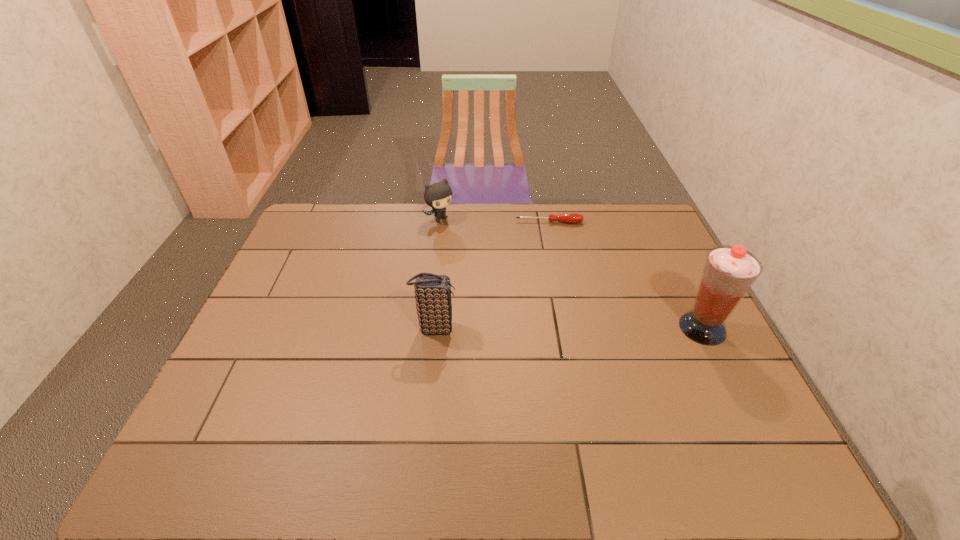
Where is `vacant area that lies between the second object from right to left and the smoothie`? The height and width of the screenshot is (540, 960). vacant area that lies between the second object from right to left and the smoothie is located at coordinates (626, 275).

This screenshot has height=540, width=960. What are the coordinates of `vacant area that lies between the screwdriver and the tallest object` in the screenshot? It's located at (626, 275).

At what (x,y) coordinates should I click in order to perform the action: click on the closest object relative to the tallest object. Please return your answer as a coordinate pair (x, y). Looking at the image, I should click on (569, 217).

Identify which object is the closest to the kitten. Please provide its 2D coordinates. Your answer should be formatted as a tuple, i.e. [(x, y)], where the tuple contains the x and y coordinates of a point satisfying the conditions above.

[(569, 217)]